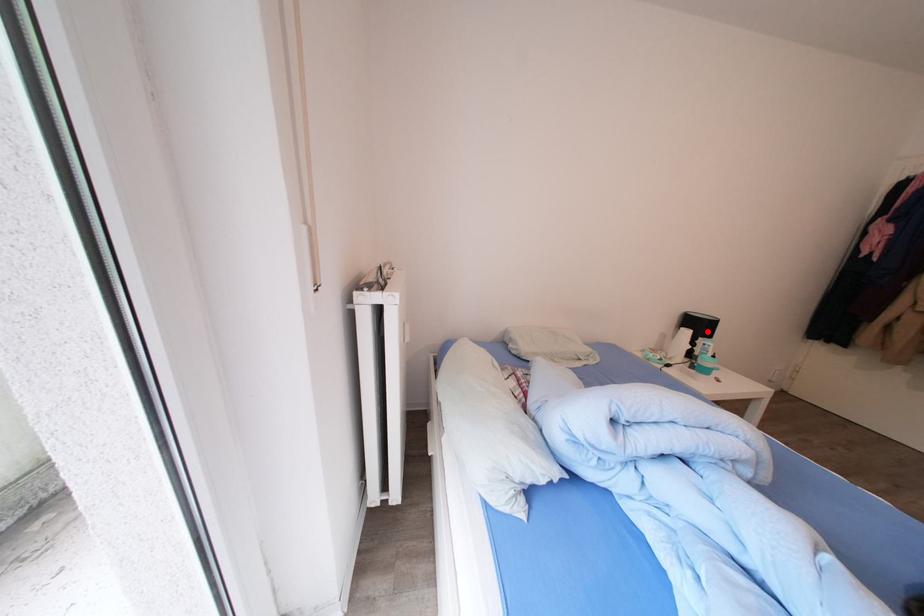
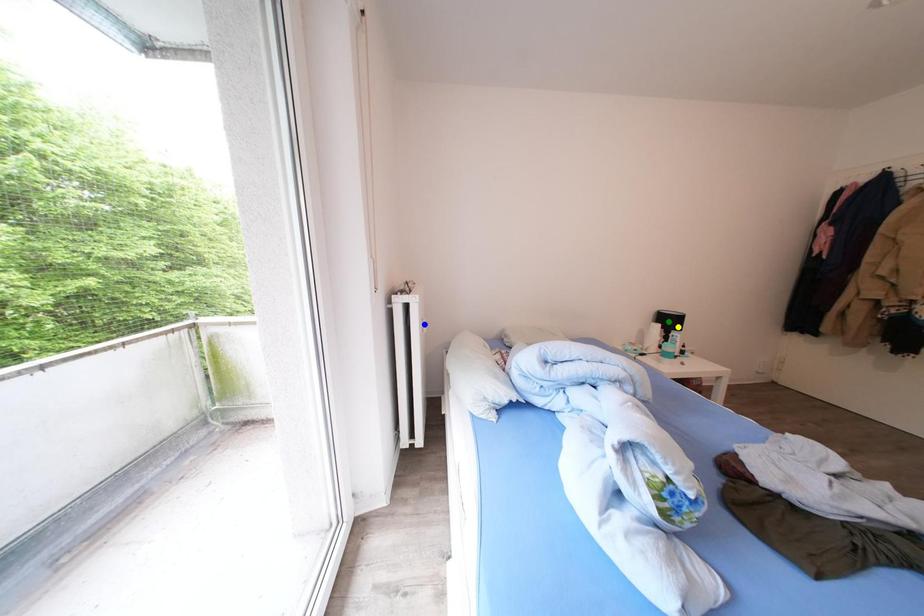
Question: I am providing you with two images of the same scene from different viewpoints. A red point is marked on the first image. You are given multiple points on the second image. Which mark in image 2 goes with the point in image 1?

Choices:
 (A) blue point
 (B) yellow point
 (C) green point

Answer: (B)